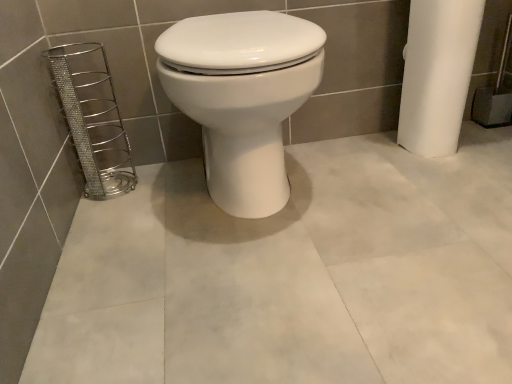
The height and width of the screenshot is (384, 512). In order to click on free space to the left of white glossy toilet at center in this screenshot , I will do `click(125, 216)`.